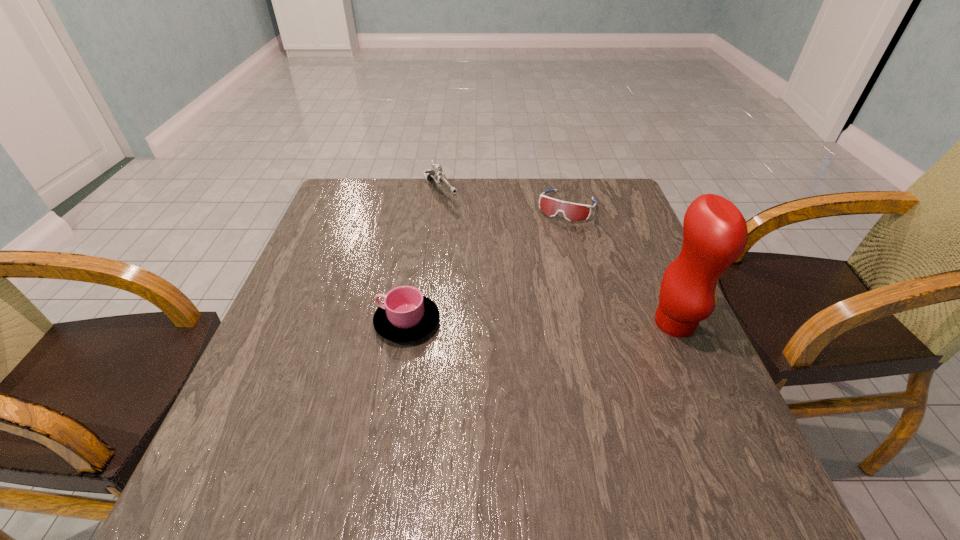
Image resolution: width=960 pixels, height=540 pixels. In order to click on free spot located on the front-facing side of the second object from right to left in this screenshot , I will do (x=526, y=284).

Identify the location of free spot located aimed along the barrel of the gun. This screenshot has height=540, width=960. (461, 224).

Locate an element on the screen. The image size is (960, 540). vacant space located 0.110m aimed along the barrel of the gun is located at coordinates (464, 228).

Identify the location of vacant point located 0.080m aimed along the barrel of the gun. (459, 222).

The width and height of the screenshot is (960, 540). Identify the location of goggles at the far edge. (572, 212).

The height and width of the screenshot is (540, 960). What are the coordinates of `gun that is at the far edge` in the screenshot? It's located at (x=436, y=173).

The height and width of the screenshot is (540, 960). Find the location of `condiment present at the right edge`. condiment present at the right edge is located at coordinates (715, 234).

This screenshot has height=540, width=960. I want to click on goggles located at the right edge, so click(572, 212).

At what (x,y) coordinates should I click in order to perform the action: click on object located in the far right corner section of the desktop. Please return your answer as a coordinate pair (x, y). The width and height of the screenshot is (960, 540). Looking at the image, I should click on (572, 212).

The image size is (960, 540). In the image, there is a desktop. What are the coordinates of `free space at the far edge` in the screenshot? It's located at (529, 204).